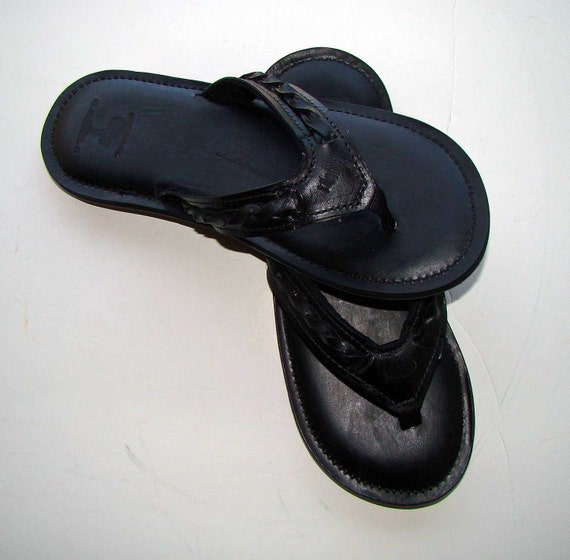
The height and width of the screenshot is (560, 570). Identify the location of floor. (227, 519).